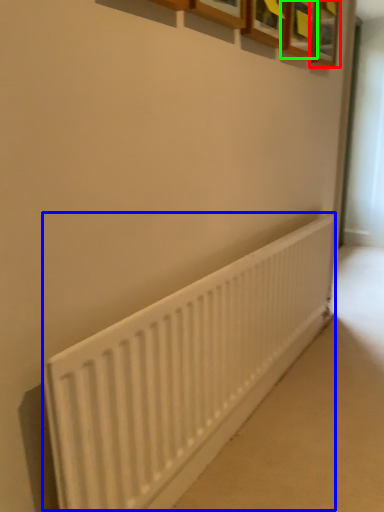
Question: Based on their relative distances, which object is nearer to picture frame (highlighted by a red box)? Choose from radiator (highlighted by a blue box) and picture frame (highlighted by a green box).

Choices:
 (A) radiator
 (B) picture frame

Answer: (B)